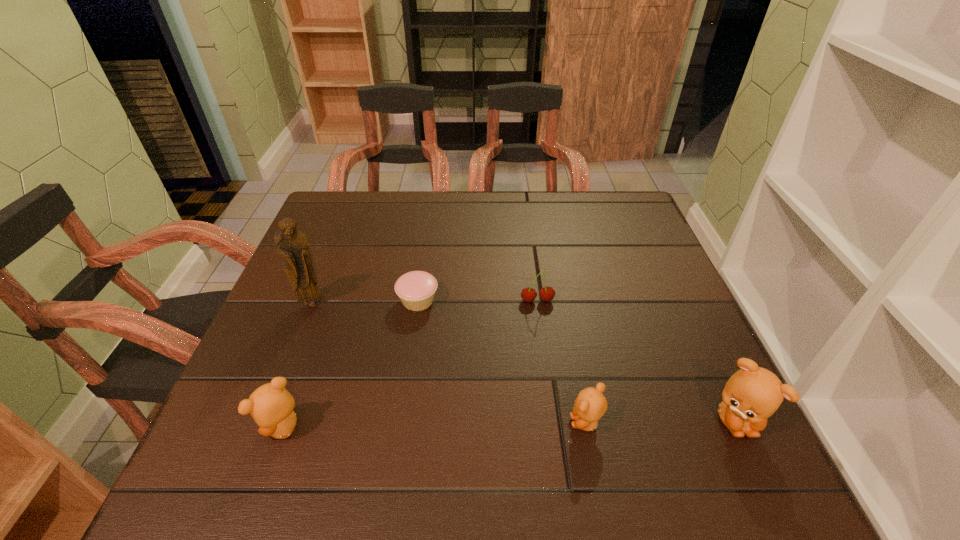
The image size is (960, 540). I want to click on free location that satisfies the following two spatial constraints: 1. on the front side of the cupcake; 2. on the face of the second tallest teddy bear, so click(399, 428).